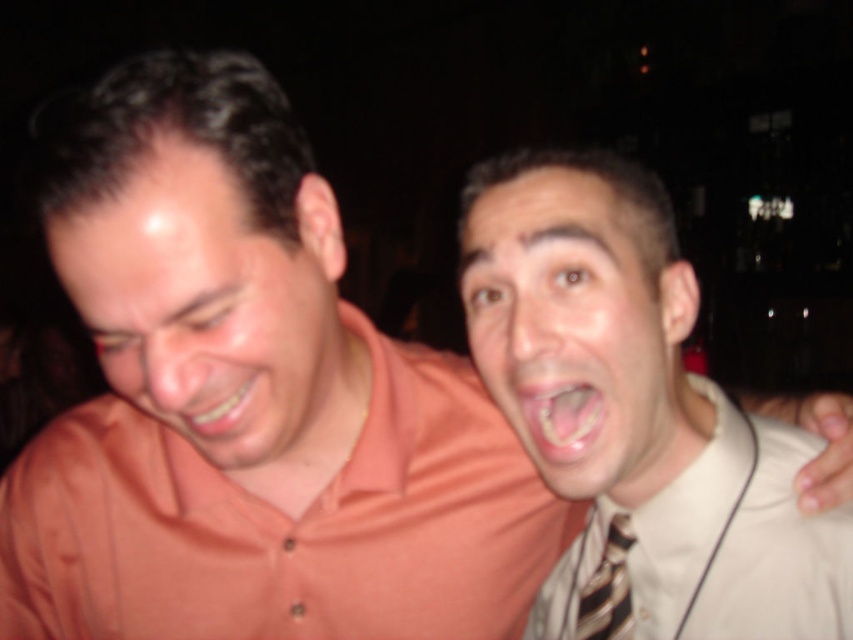
Who is lower down, light beige shirt with striped tie at right or striped fabric tie at right?

striped fabric tie at right is below.

Where is `light beige shirt with striped tie at right`? light beige shirt with striped tie at right is located at coordinates (641, 406).

Who is positioned more to the right, smooth skin face at right or striped fabric tie at right?

From the viewer's perspective, striped fabric tie at right appears more on the right side.

Between point (653, 467) and point (616, 625), which one is positioned in front?

Point (653, 467) is in front.

Image resolution: width=853 pixels, height=640 pixels. In order to click on smooth skin face at right in this screenshot , I will do `click(577, 332)`.

Does pink glossy tongue at center appear under matte yellow teeth at center?

Yes.

Between point (531, 433) and point (224, 413), which one is positioned in front?

Point (224, 413)

Identify the location of pink glossy tongue at center. The height and width of the screenshot is (640, 853). (561, 417).